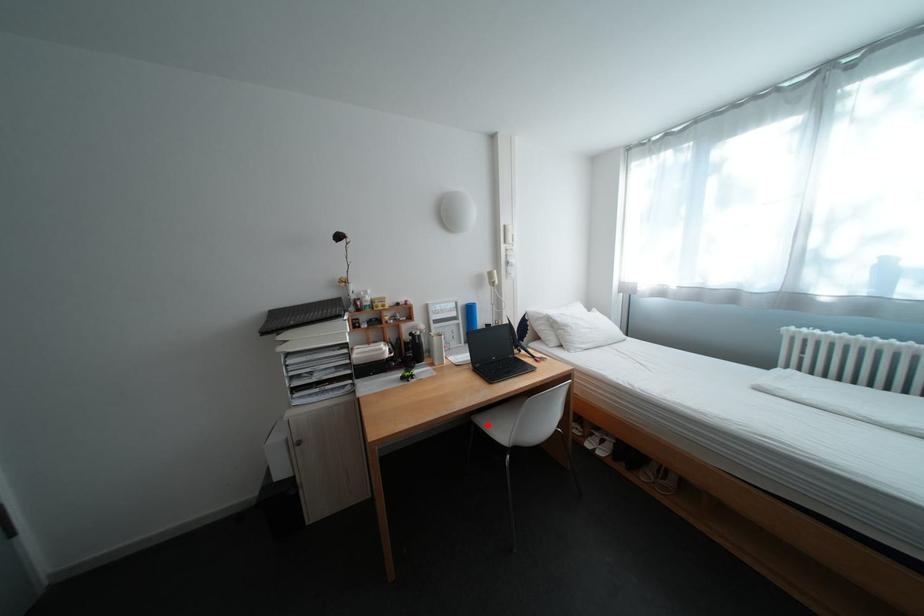
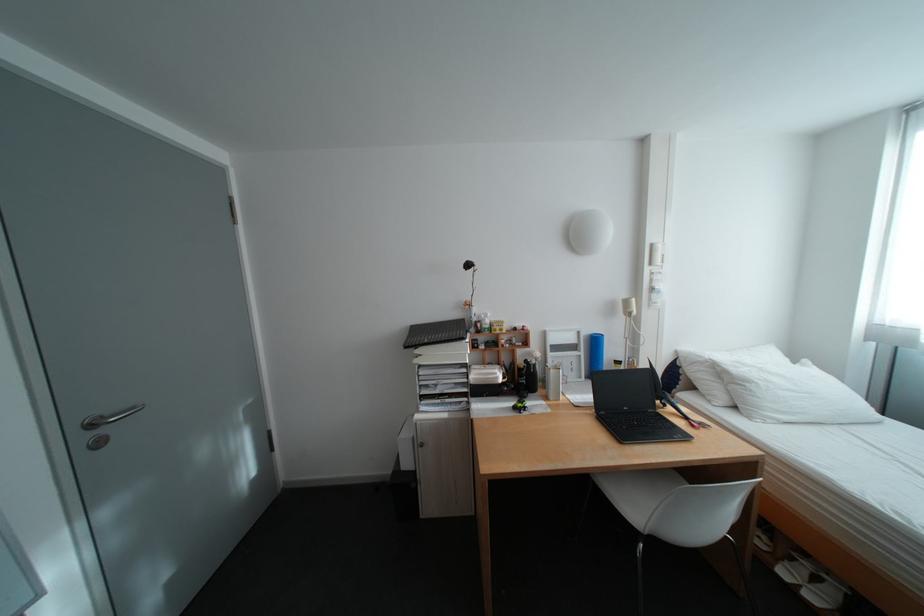
Find the pixel in the second image that matches the highlighted location in the first image.

(606, 483)